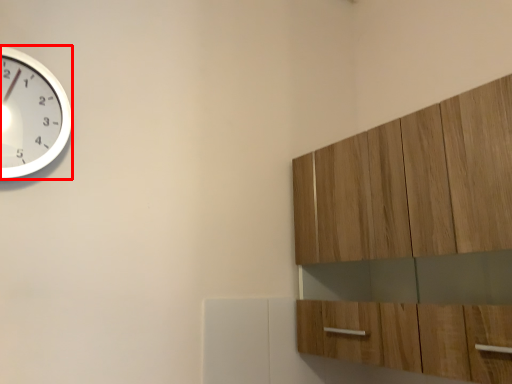
Question: From the image's perspective, what is the correct spatial relationship of wall clock (annotated by the red box) in relation to cabinetry?

Choices:
 (A) below
 (B) above

Answer: (B)